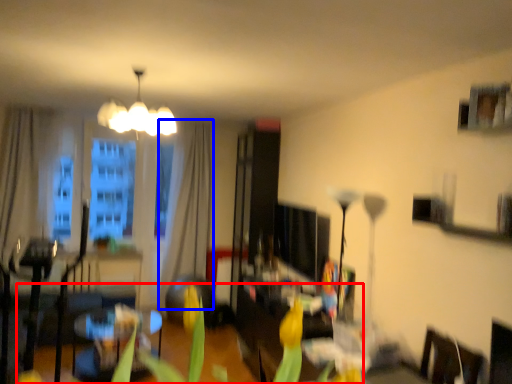
Question: Which object is closer to the camera taking this photo, plant (highlighted by a red box) or curtain (highlighted by a blue box)?

Choices:
 (A) plant
 (B) curtain

Answer: (A)